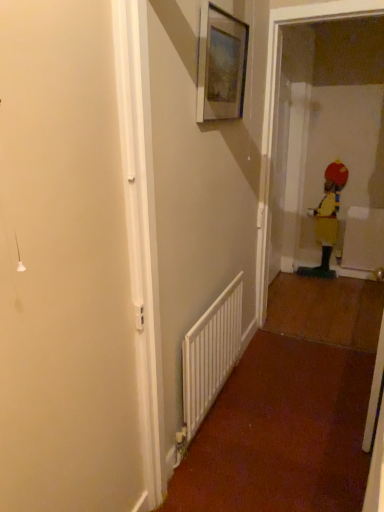
In order to face white plastic radiator at center, should I rotate leftwards or rightwards?

A 3.428 degree turn to the right will do.

You are a GUI agent. You are given a task and a screenshot of the screen. Output one action in this format:
    pyautogui.click(x=<x>, y=<y>)
    Task: Click on the white plastic radiator at center
    The width and height of the screenshot is (384, 512).
    Given the screenshot: What is the action you would take?
    pyautogui.click(x=211, y=354)

In terms of height, does yellow fabric toddler at right look taller or shorter compared to matte wooden picture frame at upper center?

Considering their sizes, yellow fabric toddler at right has more height than matte wooden picture frame at upper center.

Can you confirm if yellow fabric toddler at right is smaller than matte wooden picture frame at upper center?

No, yellow fabric toddler at right is not smaller than matte wooden picture frame at upper center.

From the image's perspective, is yellow fabric toddler at right on top of matte wooden picture frame at upper center?

No, from the image's perspective, yellow fabric toddler at right is not above matte wooden picture frame at upper center.

Which object is thinner, yellow fabric toddler at right or matte wooden picture frame at upper center?

matte wooden picture frame at upper center is thinner.

Is point (203, 18) behind point (334, 178)?

No, (203, 18) is closer to viewer.

Find the location of `picture frame in front of the yellow fabric toddler at right`. picture frame in front of the yellow fabric toddler at right is located at coordinates (221, 65).

Can we say matte wooden picture frame at upper center lies outside white plastic radiator at center?

Yes.

From the image's perspective, is matte wooden picture frame at upper center positioned above or below white plastic radiator at center?

Based on their image positions, matte wooden picture frame at upper center is located above white plastic radiator at center.

How different are the orientations of matte wooden picture frame at upper center and white plastic radiator at center in degrees?

There is a 0.00831-degree angle between the facing directions of matte wooden picture frame at upper center and white plastic radiator at center.

Considering the relative positions of matte wooden picture frame at upper center and white plastic radiator at center in the image provided, is matte wooden picture frame at upper center to the left of white plastic radiator at center from the viewer's perspective?

In fact, matte wooden picture frame at upper center is to the right of white plastic radiator at center.

Is white plastic radiator at center directly adjacent to yellow fabric toddler at right?

No, white plastic radiator at center is not with yellow fabric toddler at right.

Considering the relative sizes of white plastic radiator at center and yellow fabric toddler at right in the image provided, is white plastic radiator at center wider than yellow fabric toddler at right?

No, white plastic radiator at center is not wider than yellow fabric toddler at right.

Considering the sizes of objects white plastic radiator at center and yellow fabric toddler at right in the image provided, who is smaller, white plastic radiator at center or yellow fabric toddler at right?

With smaller size is white plastic radiator at center.

The image size is (384, 512). What are the coordinates of `radiator below the yellow fabric toddler at right (from a real-world perspective)` in the screenshot? It's located at coord(211,354).

Is yellow fabric toddler at right to the right of white plastic radiator at center from the viewer's perspective?

Yes.

Is yellow fabric toddler at right directly adjacent to white plastic radiator at center?

yellow fabric toddler at right and white plastic radiator at center are not in contact.

From a real-world perspective, is yellow fabric toddler at right on top of white plastic radiator at center?

Indeed, from a real-world perspective, yellow fabric toddler at right stands above white plastic radiator at center.

Between white plastic radiator at center and matte wooden picture frame at upper center, which one appears on the right side from the viewer's perspective?

Positioned to the right is matte wooden picture frame at upper center.

Is white plastic radiator at center far away from matte wooden picture frame at upper center?

Yes, white plastic radiator at center is far from matte wooden picture frame at upper center.

From a real-world perspective, is white plastic radiator at center above or below matte wooden picture frame at upper center?

white plastic radiator at center is below matte wooden picture frame at upper center.

The image size is (384, 512). Find the location of `toddler below the matte wooden picture frame at upper center (from a real-world perspective)`. toddler below the matte wooden picture frame at upper center (from a real-world perspective) is located at coordinates (328, 216).

In order to click on picture frame above the yellow fabric toddler at right (from a real-world perspective) in this screenshot , I will do `click(221, 65)`.

Looking at the image, which one is located further to yellow fabric toddler at right, matte wooden picture frame at upper center or white plastic radiator at center?

matte wooden picture frame at upper center is further to yellow fabric toddler at right.

Which object lies further to the anchor point white plastic radiator at center, matte wooden picture frame at upper center or yellow fabric toddler at right?

Based on the image, yellow fabric toddler at right appears to be further to white plastic radiator at center.

In the scene shown: Estimate the real-world distances between objects in this image. Which object is closer to matte wooden picture frame at upper center, white plastic radiator at center or yellow fabric toddler at right?

Based on the image, white plastic radiator at center appears to be nearer to matte wooden picture frame at upper center.

From the image, which object appears to be farther from yellow fabric toddler at right, white plastic radiator at center or matte wooden picture frame at upper center?

Based on the image, matte wooden picture frame at upper center appears to be further to yellow fabric toddler at right.

Looking at the image, which one is located closer to matte wooden picture frame at upper center, yellow fabric toddler at right or white plastic radiator at center?

Answer: Among the two, white plastic radiator at center is located nearer to matte wooden picture frame at upper center.

Estimate the real-world distances between objects in this image. Which object is further from white plastic radiator at center, yellow fabric toddler at right or matte wooden picture frame at upper center?

Among the two, yellow fabric toddler at right is located further to white plastic radiator at center.

Where is `radiator positioned between matte wooden picture frame at upper center and yellow fabric toddler at right from near to far`? The image size is (384, 512). radiator positioned between matte wooden picture frame at upper center and yellow fabric toddler at right from near to far is located at coordinates (211, 354).